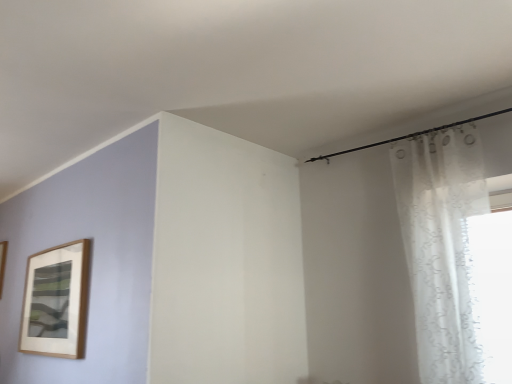
What do you see at coordinates (2, 263) in the screenshot?
I see `wooden picture frame at left` at bounding box center [2, 263].

What is the approximate height of wooden picture frame at left?

20.99 inches.

Locate an element on the screen. wooden picture frame at left is located at coordinates coord(2,263).

In order to click on white sheer curtain at right in this screenshot , I will do `click(442, 246)`.

Describe the element at coordinates (442, 246) in the screenshot. I see `white sheer curtain at right` at that location.

Where is `wooden picture frame at left`? The width and height of the screenshot is (512, 384). wooden picture frame at left is located at coordinates (2, 263).

Which is more to the right, white sheer curtain at right or wooden picture frame at left?

white sheer curtain at right.

Is white sheer curtain at right further to the viewer compared to wooden picture frame at left?

No, white sheer curtain at right is closer to the viewer.

Which is further, [447,311] or [3,270]?

Positioned behind is point [3,270].

From the image's perspective, which one is positioned higher, white sheer curtain at right or wooden picture frame at left?

From the image's view, white sheer curtain at right is above.

From a real-world perspective, between white sheer curtain at right and wooden picture frame at left, who is vertically lower?

white sheer curtain at right, from a real-world perspective.

Considering the sizes of white sheer curtain at right and wooden picture frame at left in the image, is white sheer curtain at right wider or thinner than wooden picture frame at left?

white sheer curtain at right is wider than wooden picture frame at left.

Between white sheer curtain at right and wooden picture frame at left, which one has less height?

wooden picture frame at left.

Considering the relative sizes of white sheer curtain at right and wooden picture frame at left in the image provided, is white sheer curtain at right bigger than wooden picture frame at left?

Indeed, white sheer curtain at right has a larger size compared to wooden picture frame at left.

Is wooden picture frame at left located within white sheer curtain at right?

No, wooden picture frame at left is not a part of white sheer curtain at right.

Is the surface of white sheer curtain at right in direct contact with wooden picture frame at left?

No, white sheer curtain at right is not making contact with wooden picture frame at left.

Is white sheer curtain at right facing towards wooden picture frame at left?

No, white sheer curtain at right is not turned towards wooden picture frame at left.

How far apart are white sheer curtain at right and wooden picture frame at left?

The distance of white sheer curtain at right from wooden picture frame at left is 3.62 meters.

Find the location of a particular element. picture frame located behind the white sheer curtain at right is located at coordinates (2, 263).

Considering the relative positions of wooden picture frame at left and white sheer curtain at right in the image provided, is wooden picture frame at left to the right of white sheer curtain at right from the viewer's perspective?

Incorrect, wooden picture frame at left is not on the right side of white sheer curtain at right.

Considering the relative positions of wooden picture frame at left and white sheer curtain at right in the image provided, is wooden picture frame at left in front of white sheer curtain at right?

No, wooden picture frame at left is behind white sheer curtain at right.

Is point (4, 261) closer or farther from the camera than point (435, 227)?

Point (4, 261) is positioned farther from the camera compared to point (435, 227).

From the image's perspective, between wooden picture frame at left and white sheer curtain at right, who is located below?

wooden picture frame at left is shown below in the image.

From a real-world perspective, is wooden picture frame at left over white sheer curtain at right?

Correct, in the physical world, wooden picture frame at left is higher than white sheer curtain at right.

Is wooden picture frame at left thinner than white sheer curtain at right?

Yes.

From their relative heights in the image, would you say wooden picture frame at left is taller or shorter than white sheer curtain at right?

In the image, wooden picture frame at left appears to be shorter than white sheer curtain at right.

Between wooden picture frame at left and white sheer curtain at right, which one has larger size?

Answer: With larger size is white sheer curtain at right.

Would you say wooden picture frame at left contains white sheer curtain at right?

No.

Is wooden picture frame at left in contact with white sheer curtain at right?

wooden picture frame at left is not next to white sheer curtain at right, and they're not touching.

Is white sheer curtain at right at the back of wooden picture frame at left?

No, white sheer curtain at right is not at the back of wooden picture frame at left.

Can you tell me how much wooden picture frame at left and white sheer curtain at right differ in facing direction?

They differ by 1.64 degrees in their facing directions.

Measure the distance from wooden picture frame at left to white sheer curtain at right.

They are 3.62 meters apart.

In order to click on picture frame above the white sheer curtain at right (from a real-world perspective) in this screenshot , I will do `click(2, 263)`.

Where is `curtain above the wooden picture frame at left (from the image's perspective)`? The height and width of the screenshot is (384, 512). curtain above the wooden picture frame at left (from the image's perspective) is located at coordinates (442, 246).

This screenshot has width=512, height=384. In order to click on picture frame that appears above the white sheer curtain at right (from a real-world perspective) in this screenshot , I will do `click(2, 263)`.